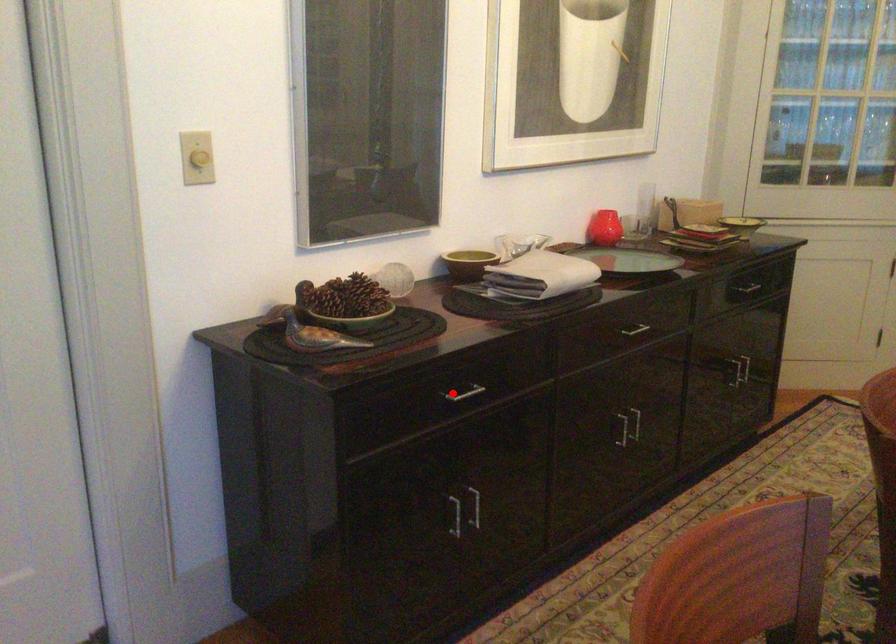
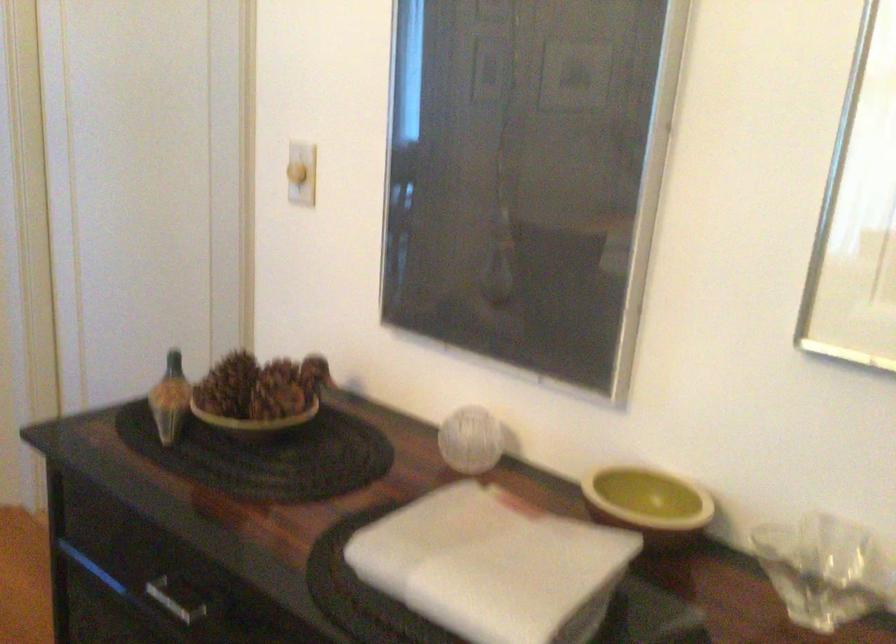
Question: I am providing you with two images of the same scene from different viewpoints. Image1 has a red point marked. In image2, the corresponding 3D location appears at what relative position? Reply with the corresponding letter.

Choices:
 (A) Closer
 (B) Farther

Answer: (A)